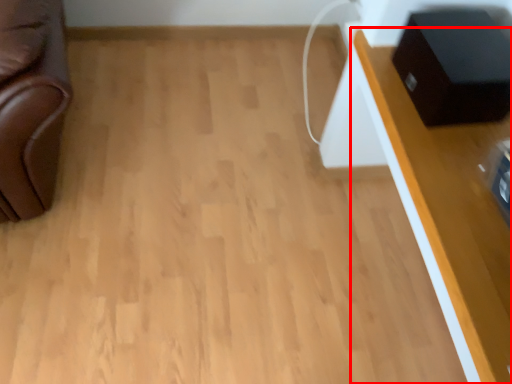
Question: Considering the relative positions of table (annotated by the red box) and speaker in the image provided, where is table (annotated by the red box) located with respect to the staircase?

Choices:
 (A) right
 (B) left

Answer: (A)